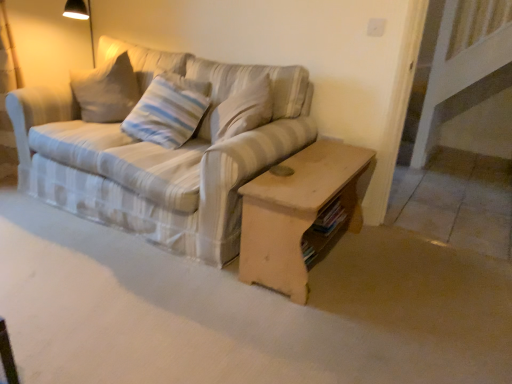
Question: Relative to striped fabric pillow at center, is wooden coffee table at center in front or behind?

Choices:
 (A) behind
 (B) front

Answer: (B)

Question: Is wooden coffee table at center inside the boundaries of striped fabric pillow at center, or outside?

Choices:
 (A) outside
 (B) inside

Answer: (A)

Question: Based on their relative distances, which object is farther from the striped fabric pillow at center?

Choices:
 (A) wooden coffee table at center
 (B) striped fabric couch at center

Answer: (A)

Question: Which is nearer to the striped fabric couch at center?

Choices:
 (A) striped fabric pillow at center
 (B) wooden coffee table at center

Answer: (A)